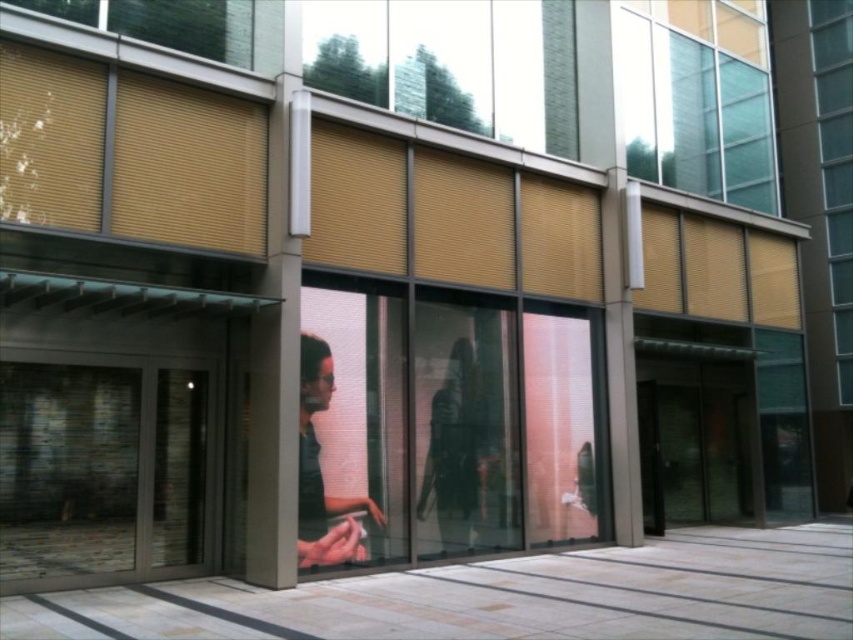
Does transparent glass door at left have a lesser height compared to translucent glass window at upper right?

Correct, transparent glass door at left is not as tall as translucent glass window at upper right.

Between transparent glass door at left and translucent glass window at upper right, which one is positioned higher?

translucent glass window at upper right is above.

Measure the distance between point (25, 422) and camera.

6.14 meters

This screenshot has width=853, height=640. What are the coordinates of `transparent glass door at left` in the screenshot? It's located at (102, 467).

Can you confirm if translucent glass window at upper right is positioned to the left of matte glass window at right?

Indeed, translucent glass window at upper right is positioned on the left side of matte glass window at right.

Can you confirm if translucent glass window at upper right is thinner than matte glass window at right?

In fact, translucent glass window at upper right might be wider than matte glass window at right.

Locate an element on the screen. The image size is (853, 640). translucent glass window at upper right is located at coordinates (697, 99).

Locate an element on the screen. The height and width of the screenshot is (640, 853). translucent glass window at upper right is located at coordinates (697, 99).

Can you confirm if matte glass window at right is smaller than matte black jacket at center?

Indeed, matte glass window at right has a smaller size compared to matte black jacket at center.

Describe the element at coordinates (834, 164) in the screenshot. The width and height of the screenshot is (853, 640). I see `matte glass window at right` at that location.

Which is in front, point (827, 128) or point (485, 488)?

Point (485, 488) is in front.

Locate an element on the screen. The height and width of the screenshot is (640, 853). matte glass window at right is located at coordinates (834, 164).